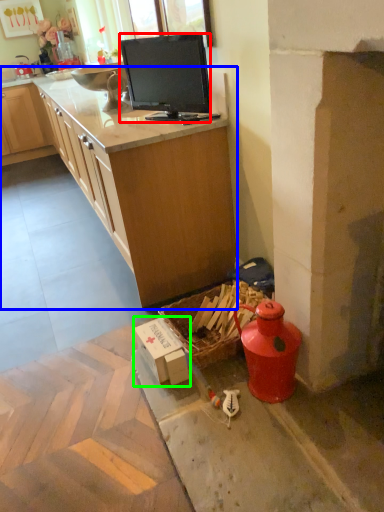
Question: Based on their relative distances, which object is farther from television (highlighted by a red box)? Choose from countertop (highlighted by a blue box) and cardboard box (highlighted by a green box).

Choices:
 (A) countertop
 (B) cardboard box

Answer: (B)